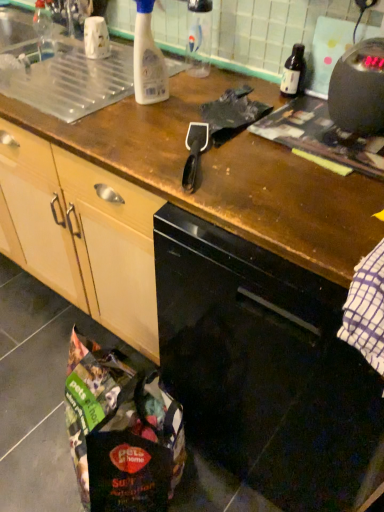
Where is `free region on the left part of translucent plastic spray bottle at upper center, arranged as the third bottle when viewed from the right`? This screenshot has height=512, width=384. free region on the left part of translucent plastic spray bottle at upper center, arranged as the third bottle when viewed from the right is located at coordinates (91, 103).